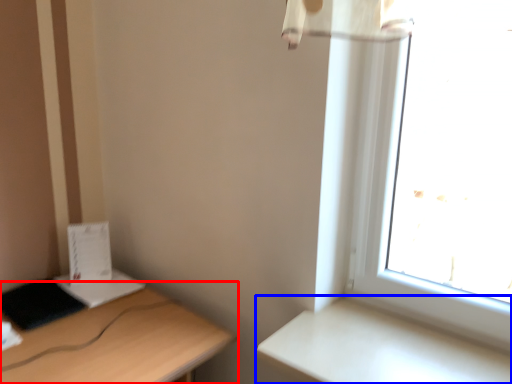
Question: Which point is further to the camera, desk (highlighted by a red box) or table (highlighted by a blue box)?

Choices:
 (A) desk
 (B) table

Answer: (B)